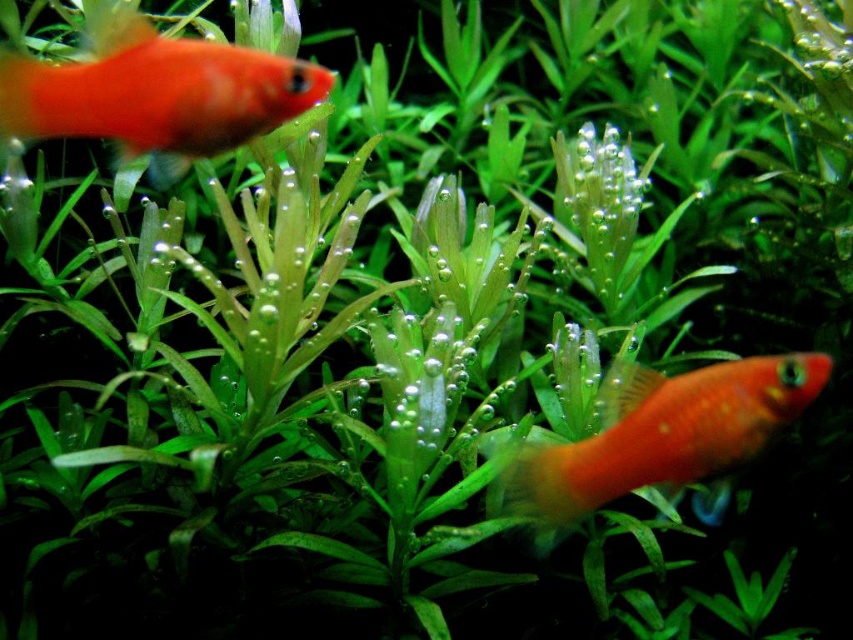
Question: Can you confirm if matte orange fish at upper left is thinner than matte orange fish at lower right?

Choices:
 (A) no
 (B) yes

Answer: (B)

Question: Can you confirm if matte orange fish at upper left is smaller than matte orange fish at lower right?

Choices:
 (A) no
 (B) yes

Answer: (B)

Question: Can you confirm if matte orange fish at upper left is smaller than matte orange fish at lower right?

Choices:
 (A) no
 (B) yes

Answer: (B)